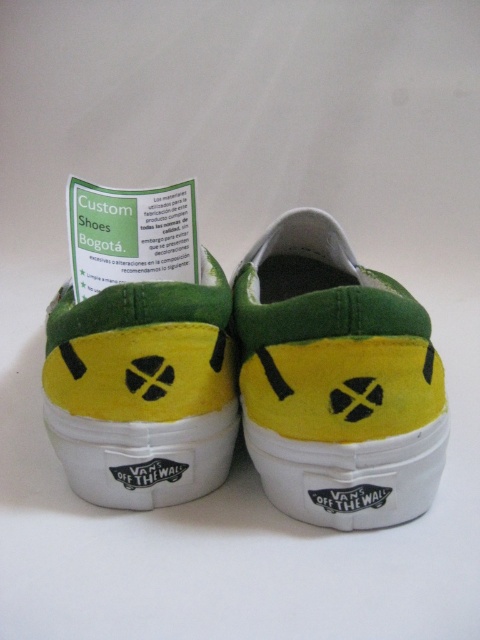
Is point (312, 360) behind point (155, 344)?

No, it is in front of (155, 344).

Is point (384, 332) positioned behind point (192, 400)?

No, (384, 332) is in front of (192, 400).

Identify the location of green felt shoe at center. (336, 380).